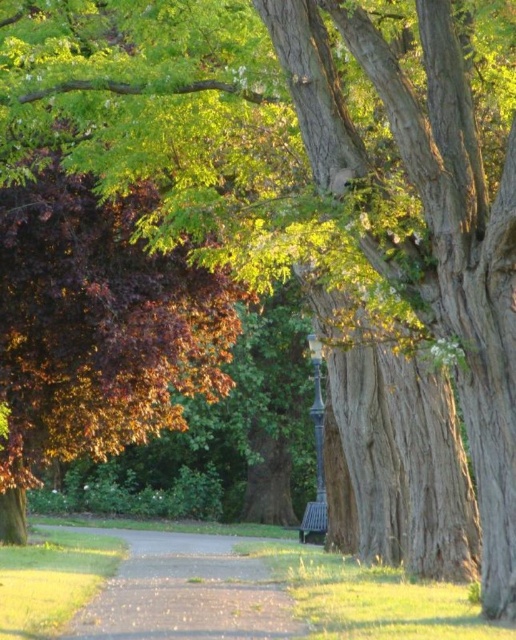
Question: Which point is closer to the camera?

Choices:
 (A) (131, 538)
 (B) (313, 525)

Answer: (B)

Question: Does gravel path at center lie behind wooden park bench at lower center?

Choices:
 (A) yes
 (B) no

Answer: (B)

Question: Which point is closer to the camera?

Choices:
 (A) (305, 516)
 (B) (116, 595)

Answer: (B)

Question: Where is gravel path at center located in relation to wooden park bench at lower center in the image?

Choices:
 (A) right
 (B) left

Answer: (B)

Question: Does gravel path at center have a smaller size compared to wooden park bench at lower center?

Choices:
 (A) no
 (B) yes

Answer: (A)